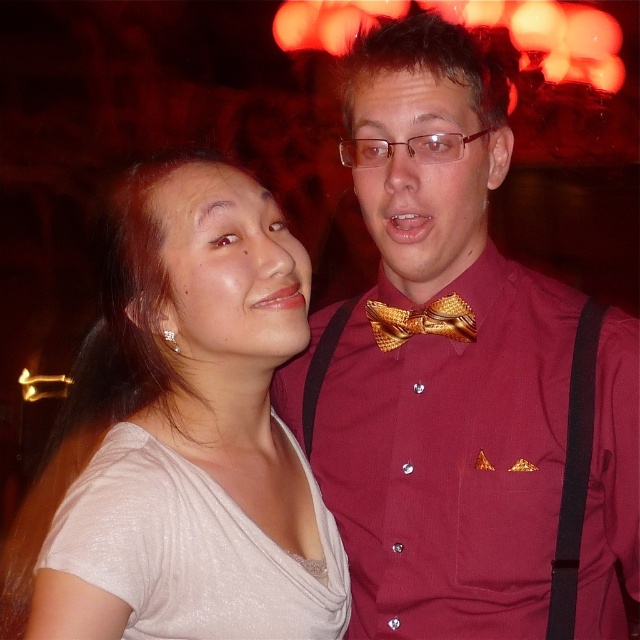
Question: Is maroon shirt at center bigger than gold textured bow tie at center?

Choices:
 (A) yes
 (B) no

Answer: (A)

Question: Based on their relative distances, which object is nearer to the satin white dress at lower left?

Choices:
 (A) maroon shirt at center
 (B) gold textured bow tie at center
 (C) satin beige blouse at left

Answer: (C)

Question: Considering the real-world distances, which object is farthest from the satin white dress at lower left?

Choices:
 (A) maroon shirt at center
 (B) gold textured bow tie at center

Answer: (B)

Question: Among these objects, which one is farthest from the camera?

Choices:
 (A) maroon shirt at center
 (B) satin beige blouse at left
 (C) gold textured bow tie at center

Answer: (C)

Question: Is satin white dress at lower left below gold textured bow tie at center?

Choices:
 (A) yes
 (B) no

Answer: (A)

Question: Does maroon shirt at center appear on the right side of gold textured bow tie at center?

Choices:
 (A) no
 (B) yes

Answer: (B)